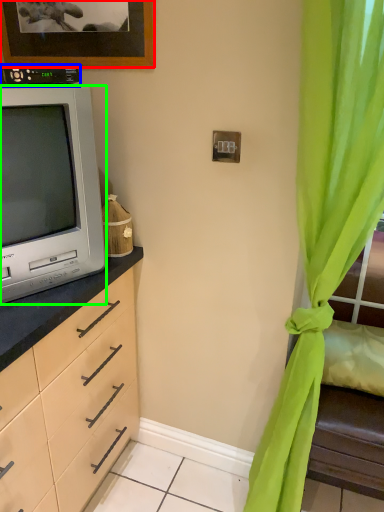
Question: Based on their relative distances, which object is nearer to picture frame (highlighted by a red box)? Choose from appliance (highlighted by a blue box) and television (highlighted by a green box).

Choices:
 (A) appliance
 (B) television

Answer: (A)